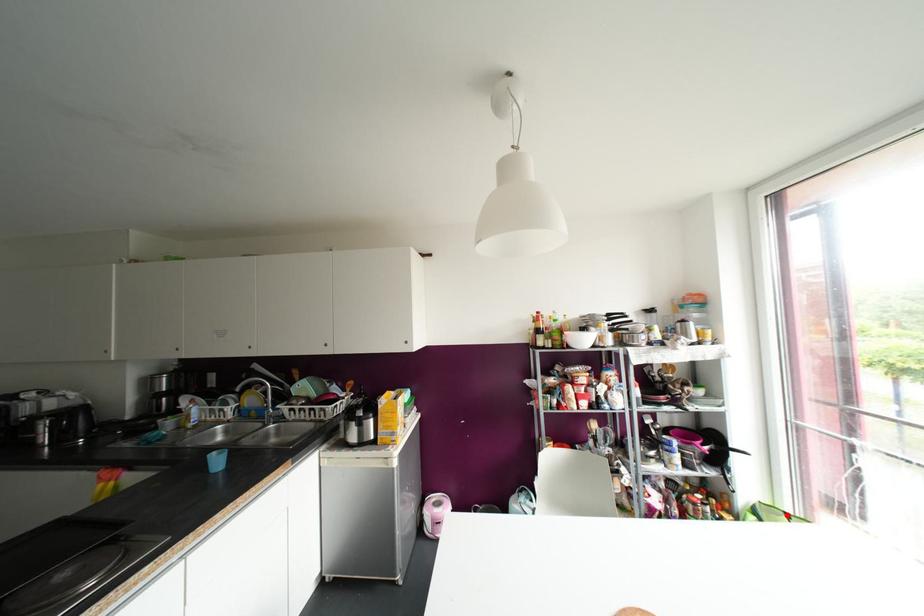
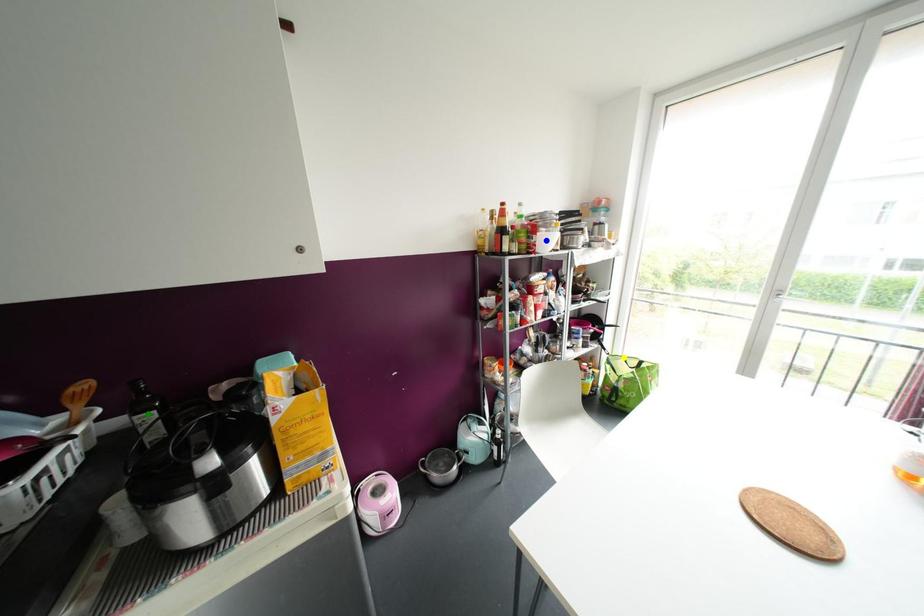
Question: I am providing you with two images of the same scene from different viewpoints. A red point is marked on the first image. You are given multiple points on the second image. In image 2, which mark is for the same physical point as the one in image 1?

Choices:
 (A) blue point
 (B) green point
 (C) yellow point

Answer: (C)